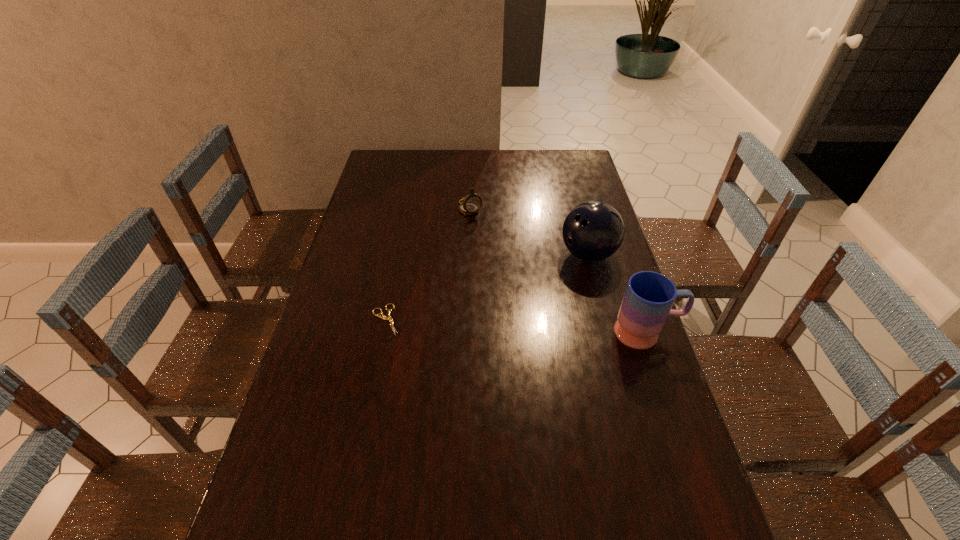
Where is `the shortest object`? The image size is (960, 540). the shortest object is located at coordinates (389, 318).

Find the location of a particular element. the leftmost object is located at coordinates (389, 318).

I want to click on mug, so click(x=649, y=296).

This screenshot has height=540, width=960. Find the location of `the third nearest object`. the third nearest object is located at coordinates (593, 231).

Find the location of a particular element. the third object from right to left is located at coordinates (471, 204).

Locate an element on the screen. The image size is (960, 540). the farthest object is located at coordinates (471, 204).

Where is `vacant area located on the right of the shortest object`? This screenshot has height=540, width=960. vacant area located on the right of the shortest object is located at coordinates (436, 319).

Image resolution: width=960 pixels, height=540 pixels. What are the coordinates of `free space located 0.140m on the surface of the bowling ball near the finger holes` in the screenshot? It's located at (548, 294).

Locate an element on the screen. The width and height of the screenshot is (960, 540). free location located on the surface of the bowling ball near the finger holes is located at coordinates (525, 317).

Identify the location of free space located 0.140m on the surface of the bowling ball near the finger holes. Image resolution: width=960 pixels, height=540 pixels. (548, 294).